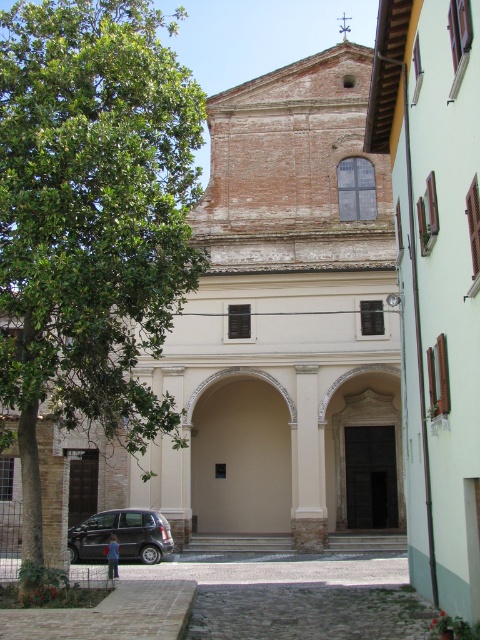
Who is lower down, green leafy tree at left or beige stone archway at center?

beige stone archway at center is below.

Is green leafy tree at left to the right of beige stone archway at center from the viewer's perspective?

In fact, green leafy tree at left is to the left of beige stone archway at center.

The image size is (480, 640). Identify the location of green leafy tree at left. (91, 221).

Where is `green leafy tree at left`? This screenshot has width=480, height=640. green leafy tree at left is located at coordinates (91, 221).

Does point (296, 109) come closer to viewer compared to point (166, 202)?

That is False.

From the picture: Who is more distant from viewer, (301, 134) or (56, 99)?

The point (301, 134) is behind.

At what (x,y) coordinates should I click in order to perform the action: click on brick textured church at center. Please return your answer as a coordinate pair (x, y). The height and width of the screenshot is (640, 480). Looking at the image, I should click on (286, 323).

Between point (162, 257) and point (103, 544), which one is positioned behind?

Positioned behind is point (103, 544).

Which is more to the right, green leafy tree at left or silver metallic car at lower left?

Positioned to the right is silver metallic car at lower left.

This screenshot has height=640, width=480. What do you see at coordinates (91, 221) in the screenshot?
I see `green leafy tree at left` at bounding box center [91, 221].

This screenshot has width=480, height=640. In order to click on green leafy tree at left in this screenshot , I will do `click(91, 221)`.